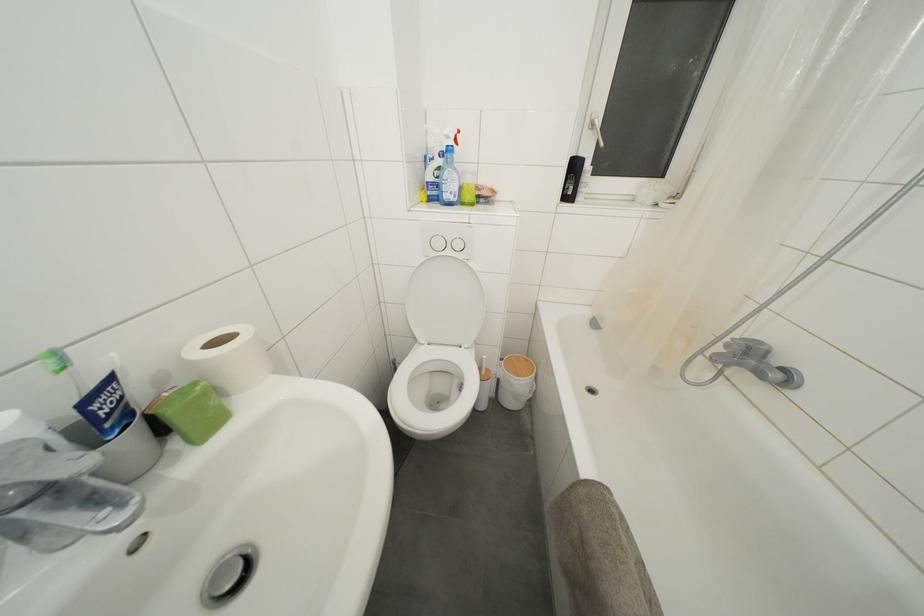
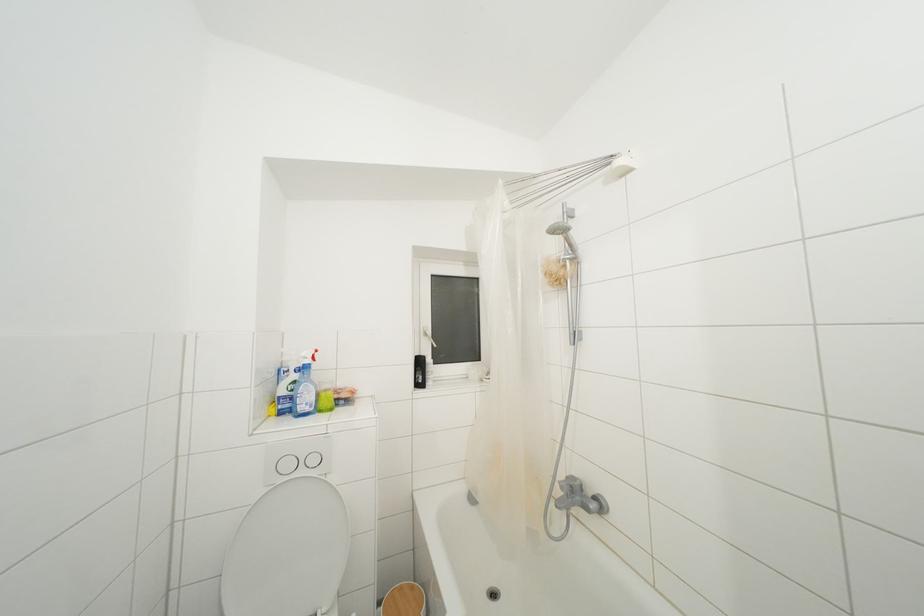
Based on the continuous images, in which direction is the camera rotating?

The rotation direction of the camera is right-up.